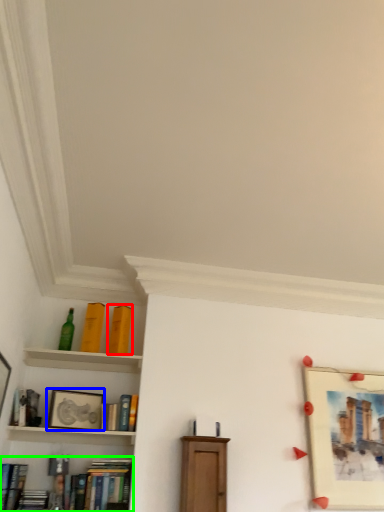
Question: Based on their relative distances, which object is farther from book (highlighted by a red box)? Choose from picture frame (highlighted by a blue box) and book (highlighted by a green box).

Choices:
 (A) picture frame
 (B) book

Answer: (B)